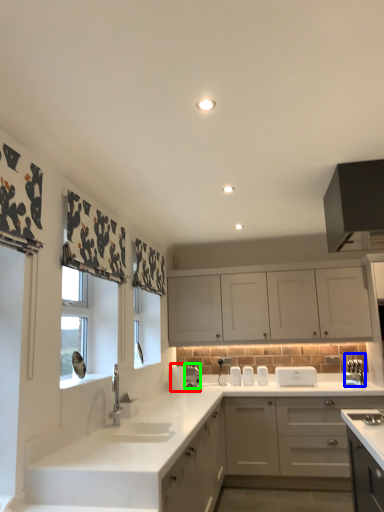
Question: Which object is the farthest from appliance (highlighted by a red box)? Choose among these: appliance (highlighted by a blue box) or appliance (highlighted by a green box).

Choices:
 (A) appliance
 (B) appliance

Answer: (A)